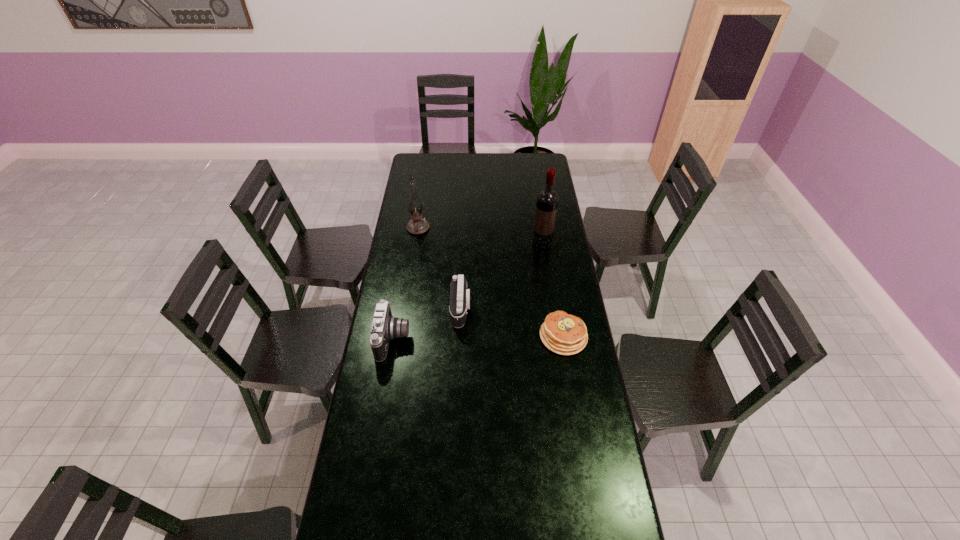
Identify the location of vacant region located on the front lens of the right camera. The width and height of the screenshot is (960, 540). (513, 309).

Image resolution: width=960 pixels, height=540 pixels. Find the location of `free space located on the left of the shortest object`. free space located on the left of the shortest object is located at coordinates (499, 336).

Find the location of a particular element. oil lamp positioned at the left edge is located at coordinates (417, 225).

Find the location of `camera that is at the left edge`. camera that is at the left edge is located at coordinates (385, 327).

What are the coordinates of `wine bottle present at the right edge` in the screenshot? It's located at (547, 200).

Locate an element on the screen. pancake located in the right edge section of the desktop is located at coordinates (564, 334).

This screenshot has height=540, width=960. I want to click on blank area at the far edge, so click(x=489, y=153).

This screenshot has height=540, width=960. I want to click on vacant space at the left edge, so click(395, 414).

The height and width of the screenshot is (540, 960). In the image, there is a desktop. Find the location of `vacant space at the right edge`. vacant space at the right edge is located at coordinates (538, 188).

In order to click on free region at the far right corner of the desktop in this screenshot , I will do point(549,159).